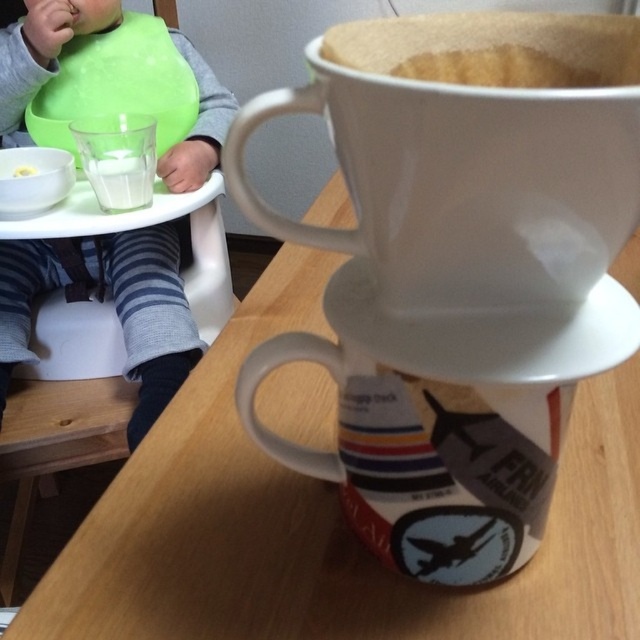
You are a parent standing in the kitchen and want to place a 12 inch long toy on the wooden table at center. Can you fit the toy on the table without it hanging over the edge?

The distance between the wooden table at center and the viewer is 12.16 inches, so the toy can be placed on the table as the distance allows for it to fit within the table space.

You are a photographer taking a picture of the scene. You notice two points marked in the image at coordinates point (182, 438) and point (404, 237). Which point is closer to your camera?

Point (182, 438) is further to the camera than point (404, 237), so the closer point to the camera is point (404, 237).

You are a parent looking at the scene. You want to hand the yellow matte spoon at upper left to the green bibbed baby at left. Can you reach the spoon without moving from your current position?

The green bibbed baby at left is to the right of the yellow matte spoon at upper left, so the spoon is positioned to the left of the baby. Since you are facing the scene, the spoon is on your left side relative to the baby, so you can likely reach it without moving.